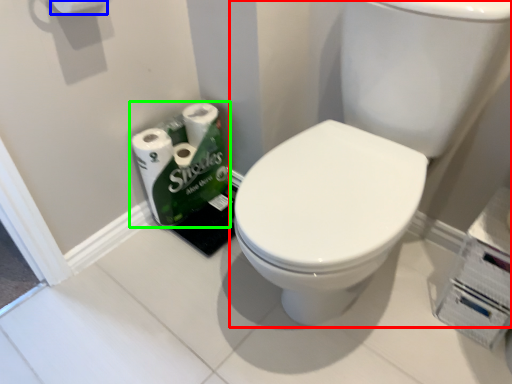
Question: Considering the real-world distances, which object is closest to sink (highlighted by a red box)? toilet paper (highlighted by a blue box) or toilet paper (highlighted by a green box).

Choices:
 (A) toilet paper
 (B) toilet paper

Answer: (B)